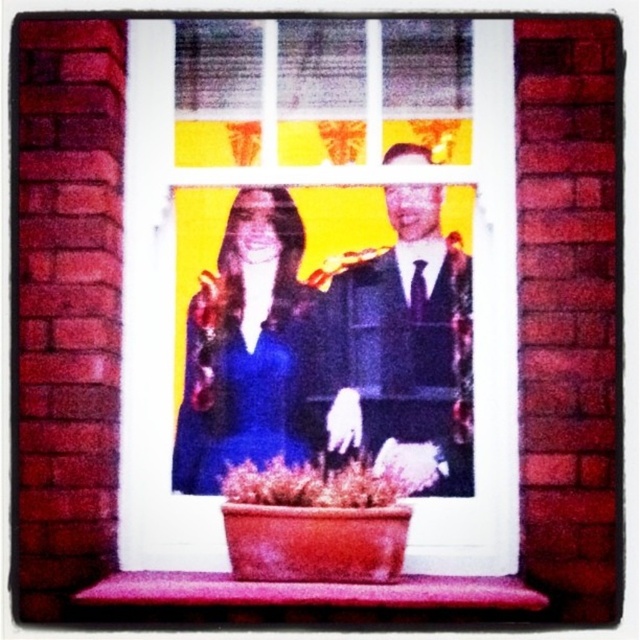
You have a decorative item that is 10 inches tall. You want to place it on the pink matte window sill at lower center without it touching the white plastic window frame at center. Is this possible?

The white plastic window frame at center is only 9.16 inches from the pink matte window sill at lower center. Since the decorative item is 10 inches tall, placing it on the sill would cause it to touch or exceed the frame, making it impossible to place without contact.

You are standing in front of the window and want to place a small decoration on the point at (272,180) and another decoration on the point at (189,577). Which point is closer to you?

Point (189,577) is closer to you because point (272,180) is behind it.